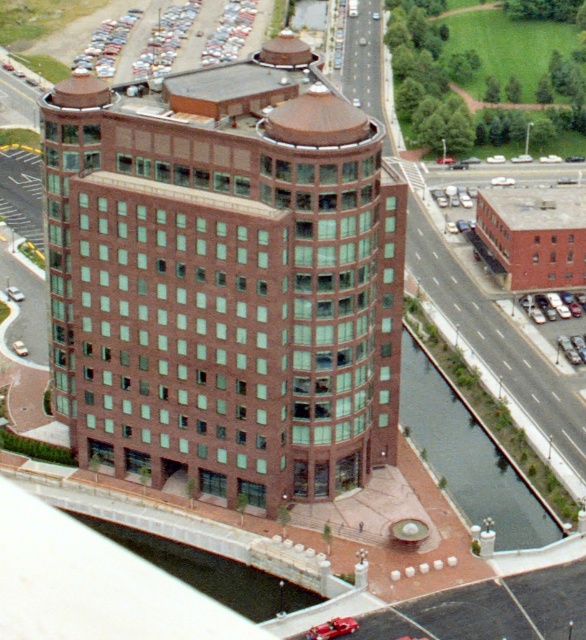
Is brown brick building at center smaller than metallic silver car at right?

Incorrect, brown brick building at center is not smaller in size than metallic silver car at right.

Which of these two, brown brick building at center or metallic silver car at right, stands taller?

Standing taller between the two is brown brick building at center.

Between point (86, 285) and point (567, 300), which one is positioned in front?

Point (86, 285) is in front.

Where is `brown brick building at center`? This screenshot has height=640, width=586. brown brick building at center is located at coordinates click(x=224, y=280).

Does brown brick building at center have a lesser height compared to shiny red car at lower center?

In fact, brown brick building at center may be taller than shiny red car at lower center.

Is brown brick building at center positioned before shiny red car at lower center?

No, brown brick building at center is further to the viewer.

Which is in front, point (304, 280) or point (323, 634)?

Point (323, 634) is more forward.

What are the coordinates of `brown brick building at center` in the screenshot? It's located at (224, 280).

Does metallic silver car at right appear on the right side of shiny red car at lower center?

Correct, you'll find metallic silver car at right to the right of shiny red car at lower center.

Based on the photo, is metallic silver car at right taller than shiny red car at lower center?

Yes.

Find the location of `metallic silver car at right`. metallic silver car at right is located at coordinates (550, 307).

The image size is (586, 640). What are the coordinates of `metallic silver car at right` in the screenshot? It's located at (550, 307).